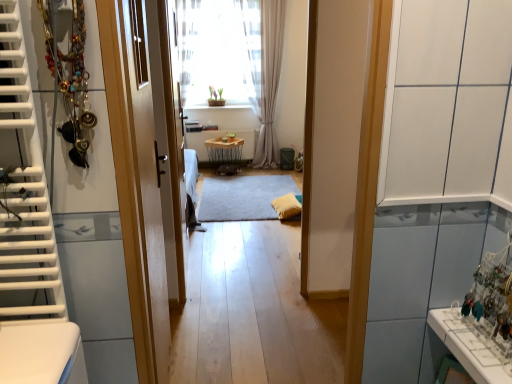
Question: Does white glossy radiator at center come in front of light beige sheer curtain at center, the second curtain from the left?

Choices:
 (A) yes
 (B) no

Answer: (B)

Question: Can you confirm if white glossy radiator at center is shorter than light beige sheer curtain at center, the 1th curtain viewed from the right?

Choices:
 (A) yes
 (B) no

Answer: (A)

Question: Is white glossy radiator at center not inside light beige sheer curtain at center, the second curtain from the left?

Choices:
 (A) no
 (B) yes

Answer: (B)

Question: Is white glossy radiator at center oriented towards light beige sheer curtain at center, the 1th curtain viewed from the right?

Choices:
 (A) yes
 (B) no

Answer: (B)

Question: From the image's perspective, is white glossy radiator at center located above light beige sheer curtain at center, the 1th curtain viewed from the right?

Choices:
 (A) no
 (B) yes

Answer: (A)

Question: From their relative heights in the image, would you say wooden door at center is taller or shorter than light beige sheer curtain at center, the second curtain from the left?

Choices:
 (A) short
 (B) tall

Answer: (A)

Question: From the image's perspective, relative to light beige sheer curtain at center, the second curtain from the left, is wooden door at center above or below?

Choices:
 (A) below
 (B) above

Answer: (A)

Question: Do you think wooden door at center is within light beige sheer curtain at center, the second curtain from the left, or outside of it?

Choices:
 (A) inside
 (B) outside

Answer: (B)

Question: Considering their positions, is wooden door at center located in front of or behind light beige sheer curtain at center, the second curtain from the left?

Choices:
 (A) front
 (B) behind

Answer: (A)

Question: From a real-world perspective, is gray soft rug at center above or below wooden door at center?

Choices:
 (A) below
 (B) above

Answer: (A)

Question: Do you think gray soft rug at center is within wooden door at center, or outside of it?

Choices:
 (A) inside
 (B) outside

Answer: (B)

Question: Considering the positions of gray soft rug at center and wooden door at center in the image, is gray soft rug at center wider or thinner than wooden door at center?

Choices:
 (A) wide
 (B) thin

Answer: (A)

Question: From the image's perspective, is gray soft rug at center above or below wooden door at center?

Choices:
 (A) below
 (B) above

Answer: (B)

Question: Looking at their shapes, would you say white glossy radiator at center is wider or thinner than wooden table at center?

Choices:
 (A) thin
 (B) wide

Answer: (A)

Question: Considering their positions, is white glossy radiator at center located in front of or behind wooden table at center?

Choices:
 (A) front
 (B) behind

Answer: (B)